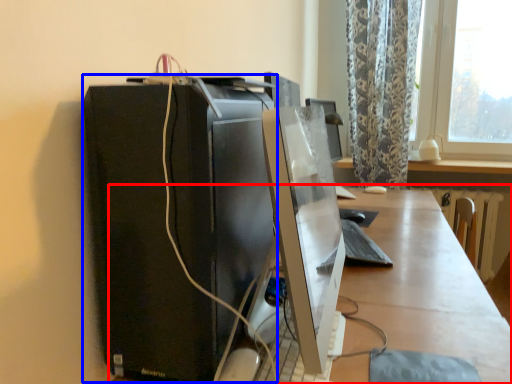
Question: Among these objects, which one is farthest to the camera, desk (highlighted by a red box) or computer tower (highlighted by a blue box)?

Choices:
 (A) desk
 (B) computer tower

Answer: (B)